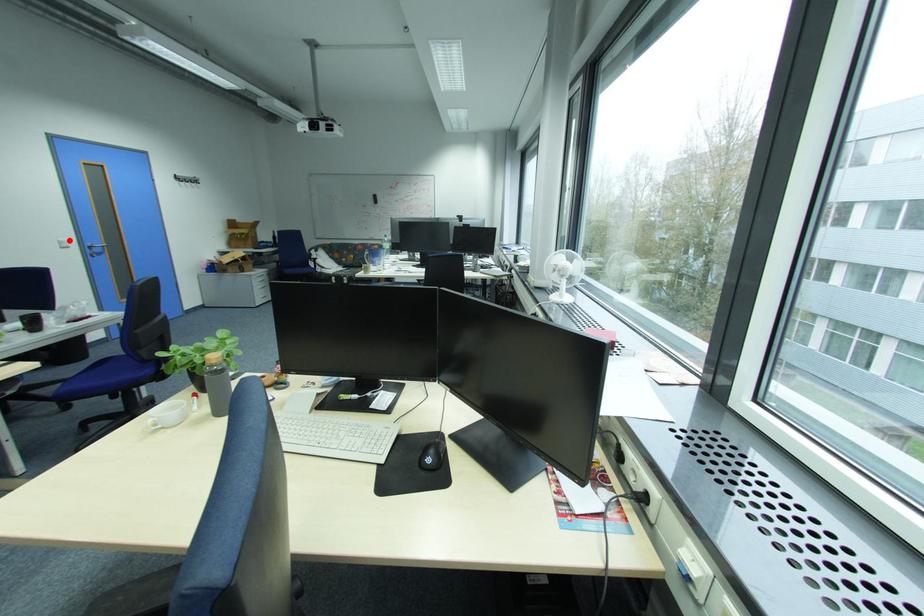
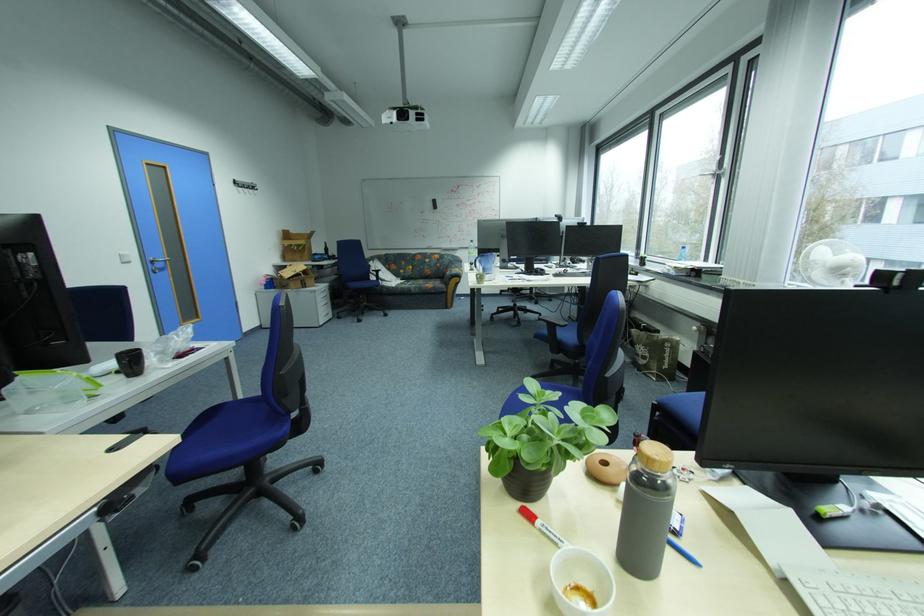
Where in the second image is the point corresponding to the highlighted location from the first image?

(130, 254)